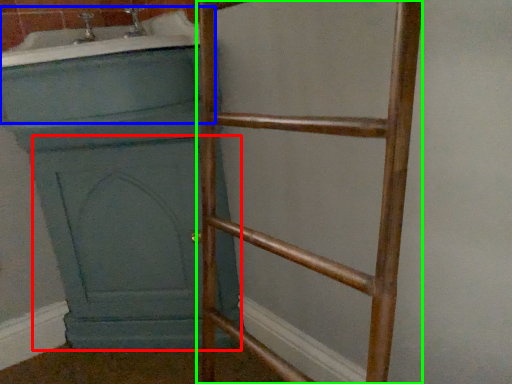
Question: Which object is the closest to the screen door (highlighted by a red box)? Choose among these: bath (highlighted by a blue box) or ladder (highlighted by a green box).

Choices:
 (A) bath
 (B) ladder

Answer: (B)